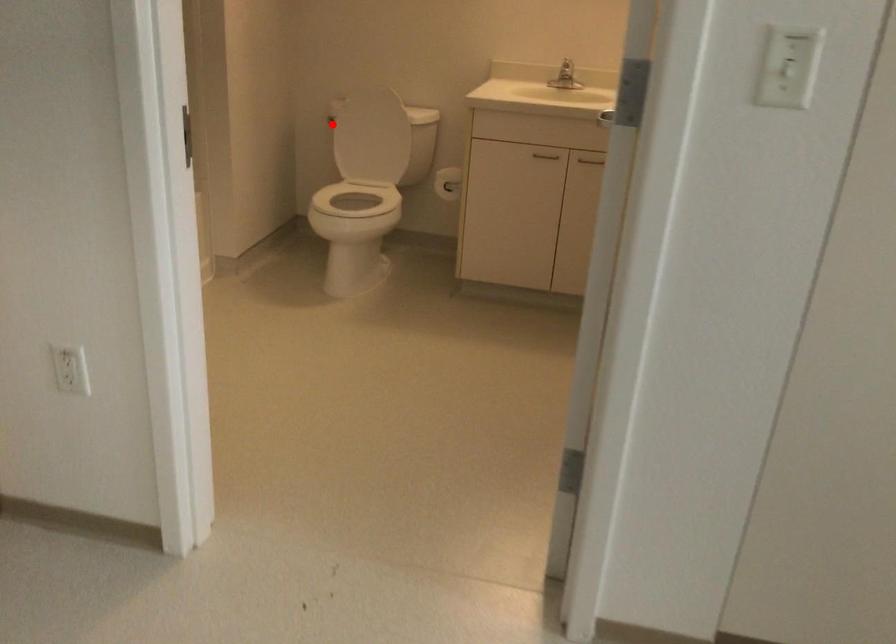
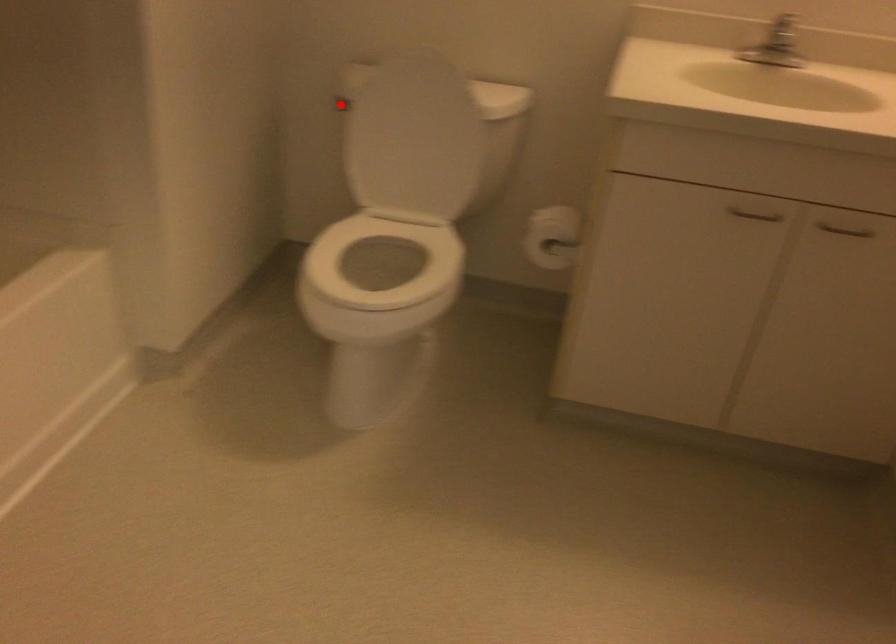
I am providing you with two images of the same scene from different viewpoints. A red point is marked on the first image and another point is marked on the second image. Do the highlighted points in image1 and image2 indicate the same real-world spot?

Yes